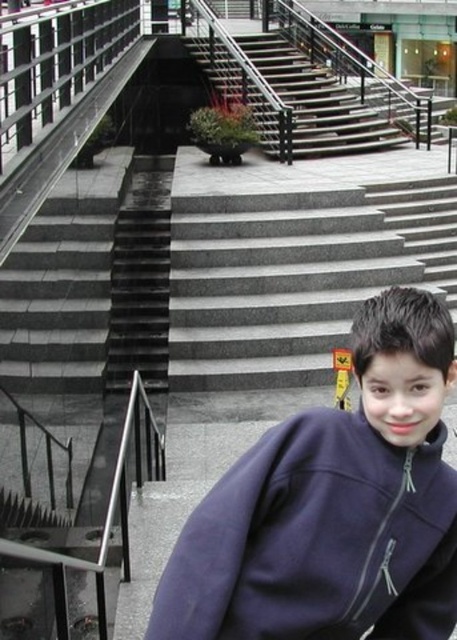
You are standing on the dark gray concrete stairs at center and want to place a dark blue fleece at center on the step in front of you. Which side of the step should you place it on to match its original position?

The dark blue fleece at center should be placed on the right side of the dark gray concrete stairs at center to match its original position.

You are a person standing on the dark gray concrete stairs at center and you see the dark blue fleece at center. Which object is taller?

The dark blue fleece at center is much taller than the dark gray concrete stairs at center.